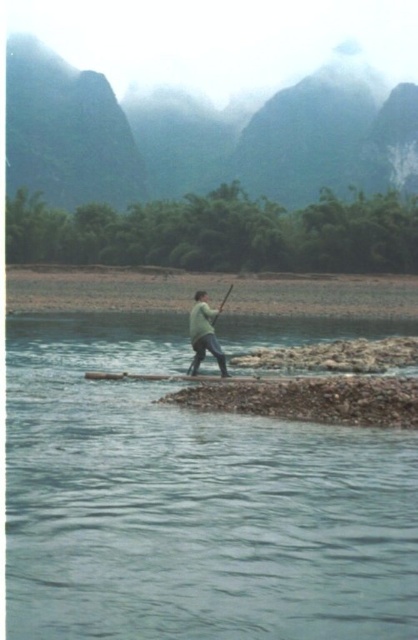
Question: From the image, what is the correct spatial relationship of clear water at center in relation to green matte paddle at center?

Choices:
 (A) right
 (B) left

Answer: (B)

Question: Which of the following is the closest to the observer?

Choices:
 (A) (191, 365)
 (B) (143, 445)

Answer: (B)

Question: Which point is farther from the camera taking this photo?

Choices:
 (A) (262, 513)
 (B) (231, 288)

Answer: (B)

Question: Is clear water at center wider than green matte paddle at center?

Choices:
 (A) no
 (B) yes

Answer: (B)

Question: Among these objects, which one is farthest from the camera?

Choices:
 (A) clear water at center
 (B) green matte paddle at center

Answer: (B)

Question: Does clear water at center appear on the left side of green matte paddle at center?

Choices:
 (A) yes
 (B) no

Answer: (A)